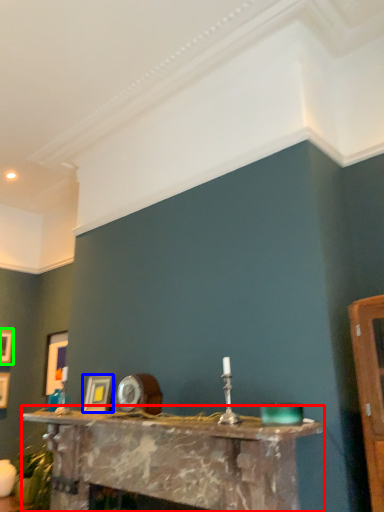
Question: Based on their relative distances, which object is farther from table (highlighted by a red box)? Choose from picture frame (highlighted by a blue box) and picture frame (highlighted by a green box).

Choices:
 (A) picture frame
 (B) picture frame

Answer: (B)